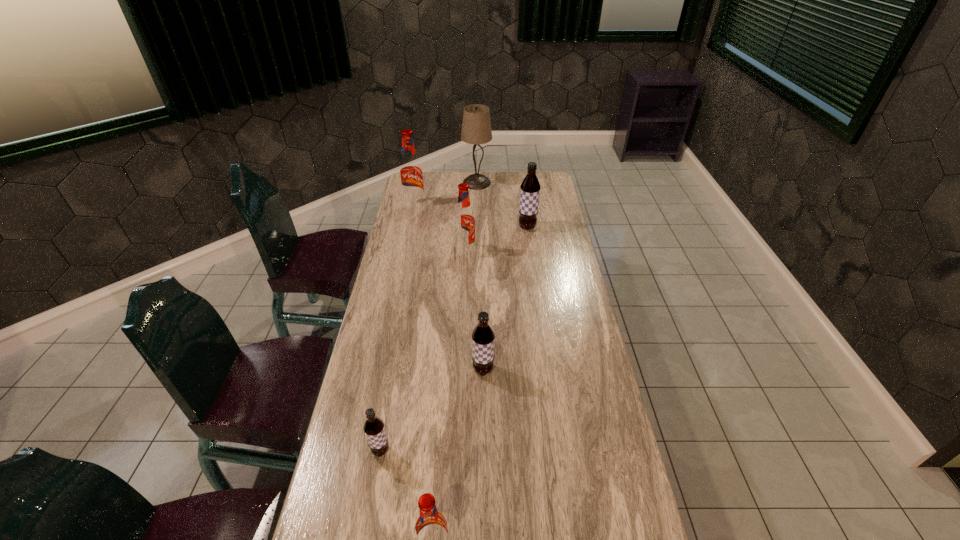
Find the location of a particular element. The image size is (960, 540). the sixth farthest object is located at coordinates (374, 429).

You are a GUI agent. You are given a task and a screenshot of the screen. Output one action in this format:
    pyautogui.click(x=<x>, y=<y>)
    Task: Click on the free space located on the front-facing side of the lampshade
    
    Given the screenshot: What is the action you would take?
    pyautogui.click(x=476, y=221)

The image size is (960, 540). Identify the location of vacant space located 0.280m on the back of the farthest root beer. (421, 172).

Where is `free space located 0.090m on the right of the fourth farthest object`? This screenshot has width=960, height=540. free space located 0.090m on the right of the fourth farthest object is located at coordinates (497, 251).

Identify the location of free space located on the front of the rightmost root beer. (536, 286).

Image resolution: width=960 pixels, height=540 pixels. Identify the location of free location located 0.150m on the left of the second brown root beer from right to left. (422, 370).

The image size is (960, 540). Find the location of `free location located on the right of the leftmost brown root beer`. free location located on the right of the leftmost brown root beer is located at coordinates (487, 451).

Locate an element on the screen. Image resolution: width=960 pixels, height=540 pixels. object that is at the far edge is located at coordinates (476, 127).

You are a GUI agent. You are given a task and a screenshot of the screen. Output one action in this format:
    pyautogui.click(x=<x>, y=<y>)
    Task: Click on the object that is positioned at the right edge
    
    Given the screenshot: What is the action you would take?
    pyautogui.click(x=530, y=187)

The height and width of the screenshot is (540, 960). Find the location of `free space at the far edge of the desktop`. free space at the far edge of the desktop is located at coordinates (449, 173).